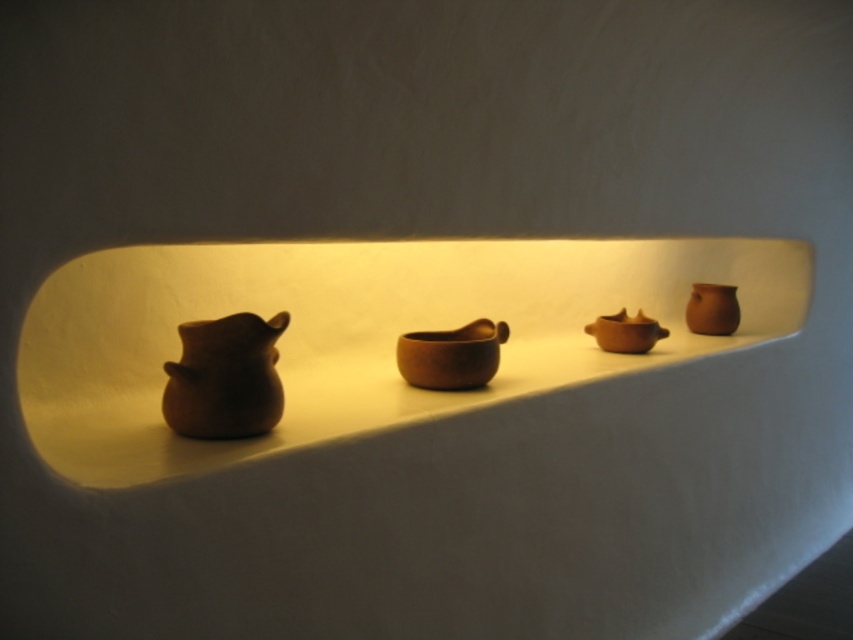
Can you confirm if matte brown vase at left is wider than matte brown bowl at center?

No, matte brown vase at left is not wider than matte brown bowl at center.

What do you see at coordinates (225, 378) in the screenshot? I see `matte brown vase at left` at bounding box center [225, 378].

Is point (223, 330) farther from camera compared to point (664, 328)?

That is False.

The width and height of the screenshot is (853, 640). In order to click on matte brown vase at left in this screenshot , I will do `click(225, 378)`.

Can you confirm if matte clay pots at center is wider than matte brown vase at left?

Correct, the width of matte clay pots at center exceeds that of matte brown vase at left.

Who is more forward, (289, 365) or (276, 314)?

Point (276, 314) is more forward.

Is point (804, 260) closer to viewer compared to point (224, 348)?

No, it is not.

At what (x,y) coordinates should I click in order to perform the action: click on matte clay pots at center. Please return your answer as a coordinate pair (x, y). Looking at the image, I should click on coord(358,332).

Which is below, matte brown bowl at center or matte clay vase at right?

matte brown bowl at center is lower down.

Which of these two, matte brown bowl at center or matte clay vase at right, stands shorter?

With less height is matte brown bowl at center.

The height and width of the screenshot is (640, 853). What are the coordinates of `matte brown bowl at center` in the screenshot? It's located at (625, 332).